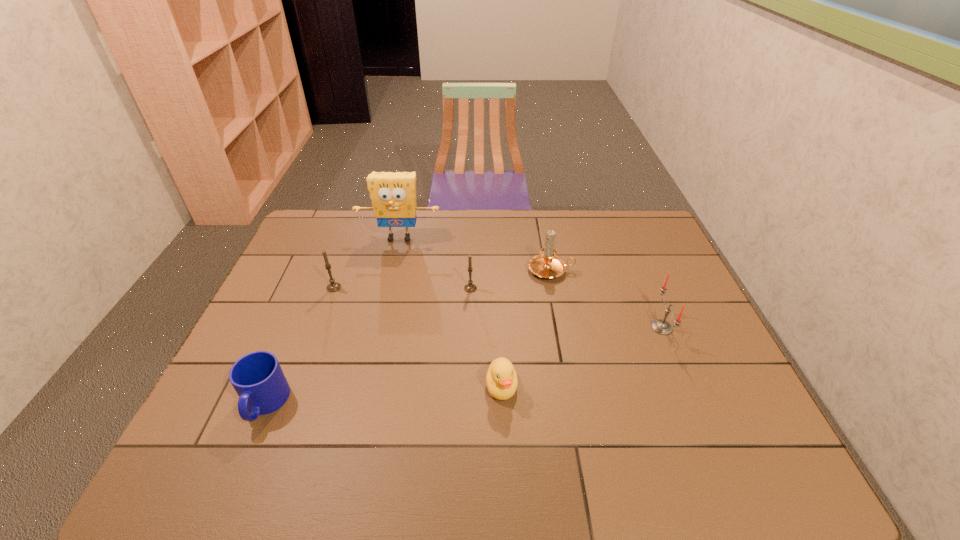
In order to click on empty location between the leftmost candle and the third candle from left to right in this screenshot , I will do `click(443, 279)`.

Locate an element on the screen. The height and width of the screenshot is (540, 960). unoccupied position between the tallest object and the rightmost candle is located at coordinates (531, 282).

Locate an element on the screen. vacant area between the fourth object from left to right and the mug is located at coordinates (368, 346).

Where is `free space between the third candle from right to left and the second object from right to left`? The width and height of the screenshot is (960, 540). free space between the third candle from right to left and the second object from right to left is located at coordinates (511, 279).

Where is `free area in between the nearest candle and the duckling`? The width and height of the screenshot is (960, 540). free area in between the nearest candle and the duckling is located at coordinates (582, 357).

This screenshot has height=540, width=960. Identify the location of unoccupied position between the second object from right to left and the fourth object from right to left. (511, 279).

Locate an element on the screen. the sixth closest object to the mug is located at coordinates (661, 326).

Identify which object is the fourth nearest to the second object from right to left. Please provide its 2D coordinates. Your answer should be formatted as a tuple, i.e. [(x, y)], where the tuple contains the x and y coordinates of a point satisfying the conditions above.

[(501, 379)]

Choose which candle is the third nearest neighbor to the leftmost candle. Please provide its 2D coordinates. Your answer should be formatted as a tuple, i.e. [(x, y)], where the tuple contains the x and y coordinates of a point satisfying the conditions above.

[(661, 326)]

Locate which candle is the closest to the leftmost candle. Please provide its 2D coordinates. Your answer should be formatted as a tuple, i.e. [(x, y)], where the tuple contains the x and y coordinates of a point satisfying the conditions above.

[(470, 287)]